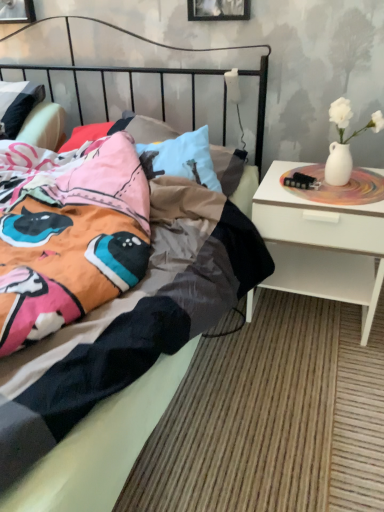
At what (x,y) coordinates should I click in order to perform the action: click on blank area beneath white glossy nightstand at right (from a real-world perspective). Please return your answer as a coordinate pair (x, y). Looking at the image, I should click on (316, 313).